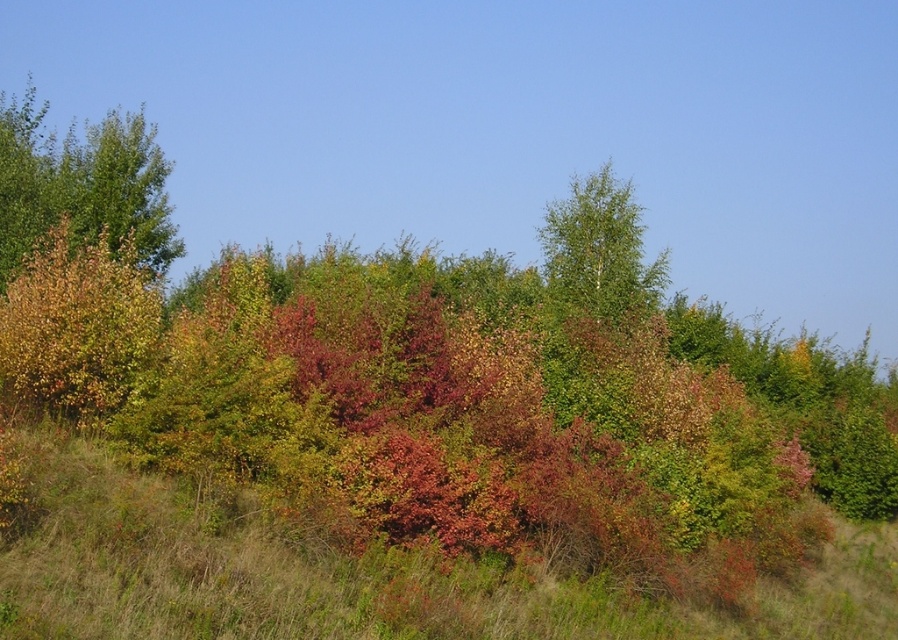
Question: Which of the following is the closest to the observer?

Choices:
 (A) (494, 609)
 (B) (579, 292)

Answer: (A)

Question: Does green grass at center lie behind green smooth tree at upper center?

Choices:
 (A) yes
 (B) no

Answer: (B)

Question: Which point is farther to the camera?

Choices:
 (A) (119, 220)
 (B) (602, 184)

Answer: (B)

Question: Does green leafy tree at upper left have a lesser width compared to green smooth tree at upper center?

Choices:
 (A) yes
 (B) no

Answer: (B)

Question: Does green grass at center have a greater width compared to green leafy tree at upper left?

Choices:
 (A) yes
 (B) no

Answer: (B)

Question: Which point appears farthest from the camera in this image?

Choices:
 (A) (629, 248)
 (B) (327, 577)
 (C) (10, 252)

Answer: (A)